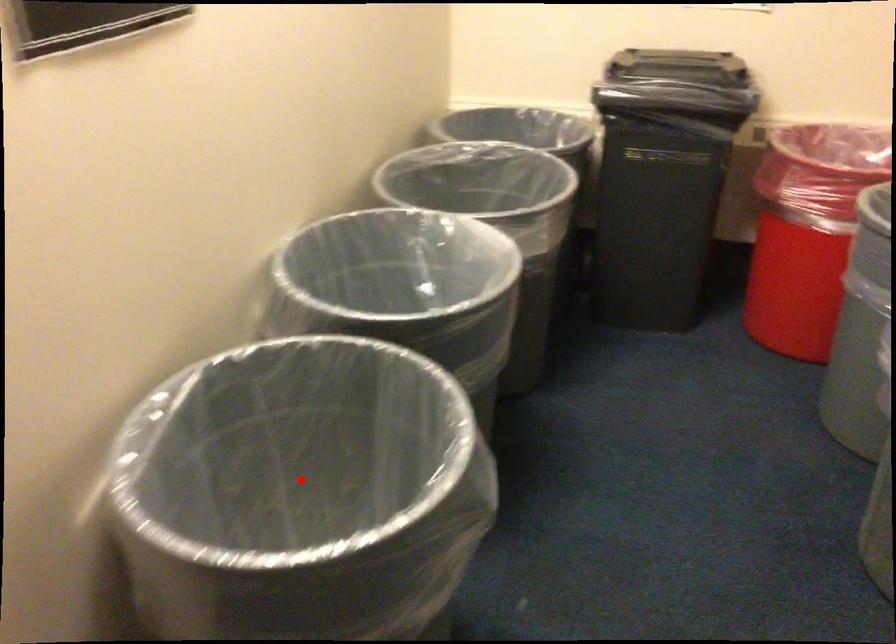
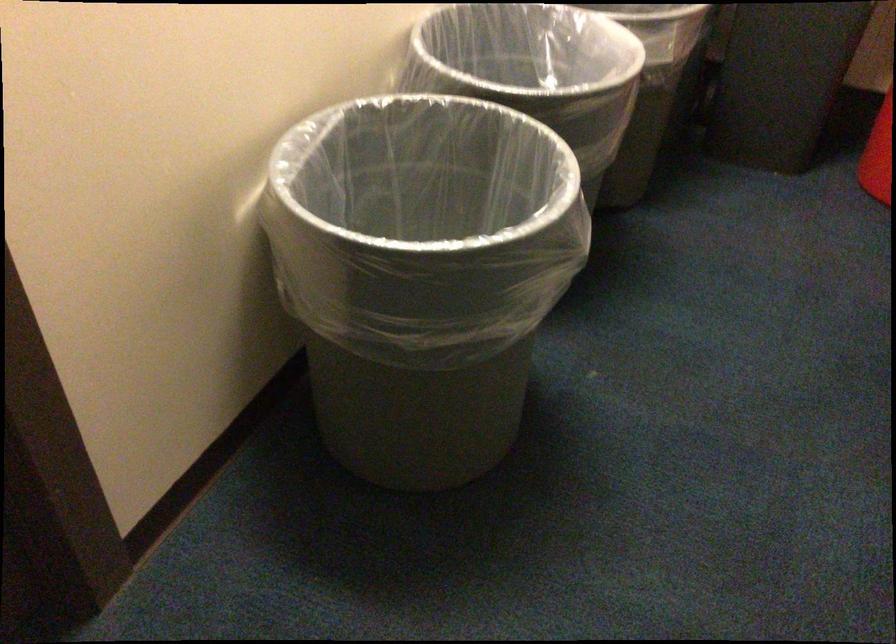
Where in the second image is the point corresponding to the highlighted location from the first image?

(410, 231)